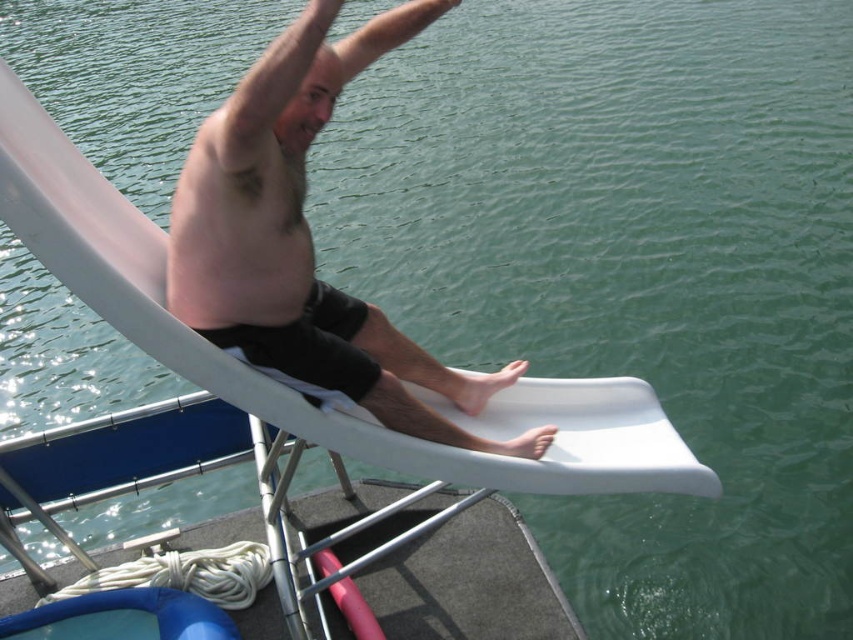
Is point (231, 209) in front of point (277, 184)?

Yes, point (231, 209) is closer to viewer.

Who is lower down, smooth skin man at center or pink smooth skin at upper center?

smooth skin man at center

Describe the element at coordinates (305, 236) in the screenshot. I see `smooth skin man at center` at that location.

The width and height of the screenshot is (853, 640). Find the location of `smooth skin man at center`. smooth skin man at center is located at coordinates (305, 236).